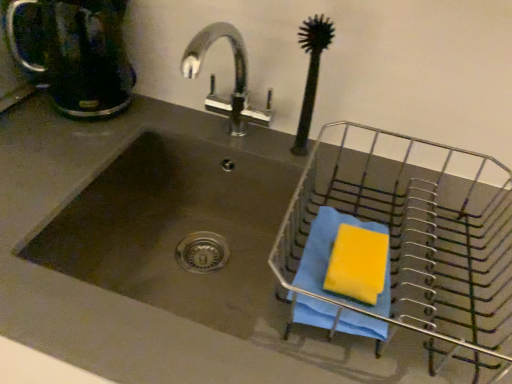
Where is `vacant space to the right of yellow sponge at right`? The width and height of the screenshot is (512, 384). vacant space to the right of yellow sponge at right is located at coordinates (446, 292).